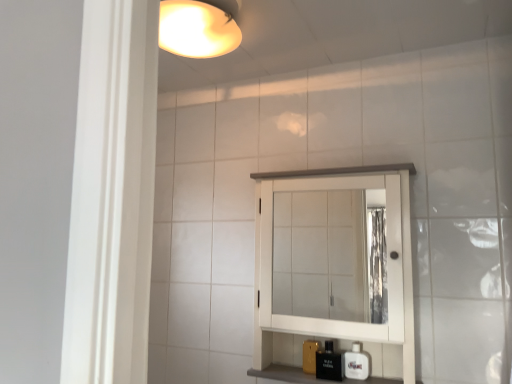
Question: Considering the relative positions of white wood medicine cabinet at center and black glossy bottle at lower center in the image provided, is white wood medicine cabinet at center to the right of black glossy bottle at lower center from the viewer's perspective?

Choices:
 (A) no
 (B) yes

Answer: (B)

Question: Are white wood medicine cabinet at center and black glossy bottle at lower center located far from each other?

Choices:
 (A) yes
 (B) no

Answer: (B)

Question: Does white wood medicine cabinet at center have a larger size compared to black glossy bottle at lower center?

Choices:
 (A) yes
 (B) no

Answer: (A)

Question: Is the depth of white wood medicine cabinet at center less than that of black glossy bottle at lower center?

Choices:
 (A) no
 (B) yes

Answer: (B)

Question: Is white wood medicine cabinet at center smaller than black glossy bottle at lower center?

Choices:
 (A) yes
 (B) no

Answer: (B)

Question: Considering their positions, is black glossy bottle at lower center located in front of or behind white wood medicine cabinet at center?

Choices:
 (A) behind
 (B) front

Answer: (A)

Question: From the image's perspective, is black glossy bottle at lower center positioned above or below white wood medicine cabinet at center?

Choices:
 (A) above
 (B) below

Answer: (B)

Question: Choose the correct answer: Is black glossy bottle at lower center inside white wood medicine cabinet at center or outside it?

Choices:
 (A) outside
 (B) inside

Answer: (B)

Question: Considering the relative positions of black glossy bottle at lower center and white wood medicine cabinet at center in the image provided, is black glossy bottle at lower center to the left or to the right of white wood medicine cabinet at center?

Choices:
 (A) left
 (B) right

Answer: (A)

Question: Considering their positions, is black glossy bottle at lower center located in front of or behind white glossy soap dispenser at lower right?

Choices:
 (A) front
 (B) behind

Answer: (A)

Question: From their relative heights in the image, would you say black glossy bottle at lower center is taller or shorter than white glossy soap dispenser at lower right?

Choices:
 (A) short
 (B) tall

Answer: (B)

Question: Is black glossy bottle at lower center bigger or smaller than white glossy soap dispenser at lower right?

Choices:
 (A) big
 (B) small

Answer: (A)

Question: From the image's perspective, is black glossy bottle at lower center located above or below white glossy soap dispenser at lower right?

Choices:
 (A) above
 (B) below

Answer: (B)

Question: Is point (385, 172) positioned closer to the camera than point (331, 379)?

Choices:
 (A) farther
 (B) closer

Answer: (B)

Question: Relative to black glossy bottle at lower center, is white wood medicine cabinet at center in front or behind?

Choices:
 (A) front
 (B) behind

Answer: (A)